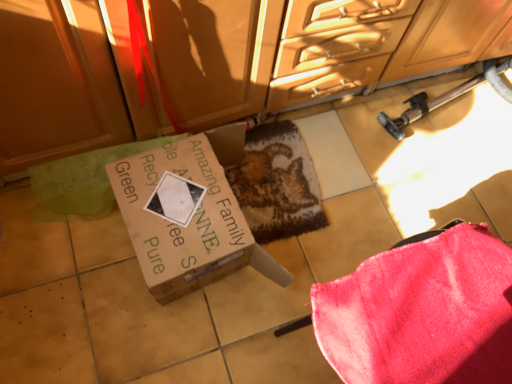
Question: Is velvety pink blanket at lower right completely or partially outside of textured brown mat at center?

Choices:
 (A) no
 (B) yes

Answer: (B)

Question: Would you say velvety pink blanket at lower right is a long distance from textured brown mat at center?

Choices:
 (A) yes
 (B) no

Answer: (B)

Question: Considering the relative sizes of velvety pink blanket at lower right and textured brown mat at center in the image provided, is velvety pink blanket at lower right thinner than textured brown mat at center?

Choices:
 (A) no
 (B) yes

Answer: (A)

Question: Is velvety pink blanket at lower right positioned with its back to textured brown mat at center?

Choices:
 (A) no
 (B) yes

Answer: (A)

Question: From the image's perspective, does velvety pink blanket at lower right appear higher than textured brown mat at center?

Choices:
 (A) yes
 (B) no

Answer: (B)

Question: From a real-world perspective, is textured brown mat at center positioned above or below velvety pink blanket at lower right?

Choices:
 (A) above
 (B) below

Answer: (B)

Question: Is textured brown mat at center bigger or smaller than velvety pink blanket at lower right?

Choices:
 (A) big
 (B) small

Answer: (B)

Question: Looking at their shapes, would you say textured brown mat at center is wider or thinner than velvety pink blanket at lower right?

Choices:
 (A) thin
 (B) wide

Answer: (A)

Question: Is textured brown mat at center to the left or to the right of velvety pink blanket at lower right in the image?

Choices:
 (A) right
 (B) left

Answer: (B)

Question: From a real-world perspective, is textured brown mat at center positioned above or below brown cardboard box at center?

Choices:
 (A) above
 (B) below

Answer: (B)

Question: Would you say textured brown mat at center is inside or outside brown cardboard box at center?

Choices:
 (A) inside
 (B) outside

Answer: (B)

Question: Relative to brown cardboard box at center, is textured brown mat at center in front or behind?

Choices:
 (A) front
 (B) behind

Answer: (B)

Question: Considering the positions of textured brown mat at center and brown cardboard box at center in the image, is textured brown mat at center taller or shorter than brown cardboard box at center?

Choices:
 (A) tall
 (B) short

Answer: (B)

Question: Is matte wood cabinetry at upper center bigger or smaller than brown cardboard box at center?

Choices:
 (A) big
 (B) small

Answer: (A)

Question: Considering the positions of matte wood cabinetry at upper center and brown cardboard box at center in the image, is matte wood cabinetry at upper center taller or shorter than brown cardboard box at center?

Choices:
 (A) tall
 (B) short

Answer: (A)